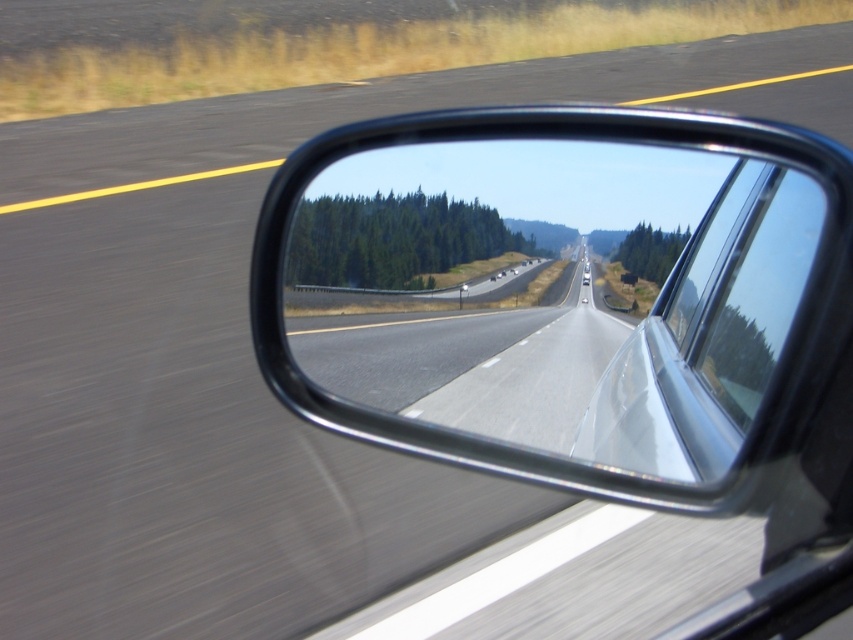
Can you confirm if black glossy mirror at center is bigger than transparent glass car window at center?

Actually, black glossy mirror at center might be smaller than transparent glass car window at center.

Is point (695, 157) closer to camera compared to point (741, 218)?

Yes, point (695, 157) is closer to viewer.

Image resolution: width=853 pixels, height=640 pixels. I want to click on black glossy mirror at center, so click(563, 294).